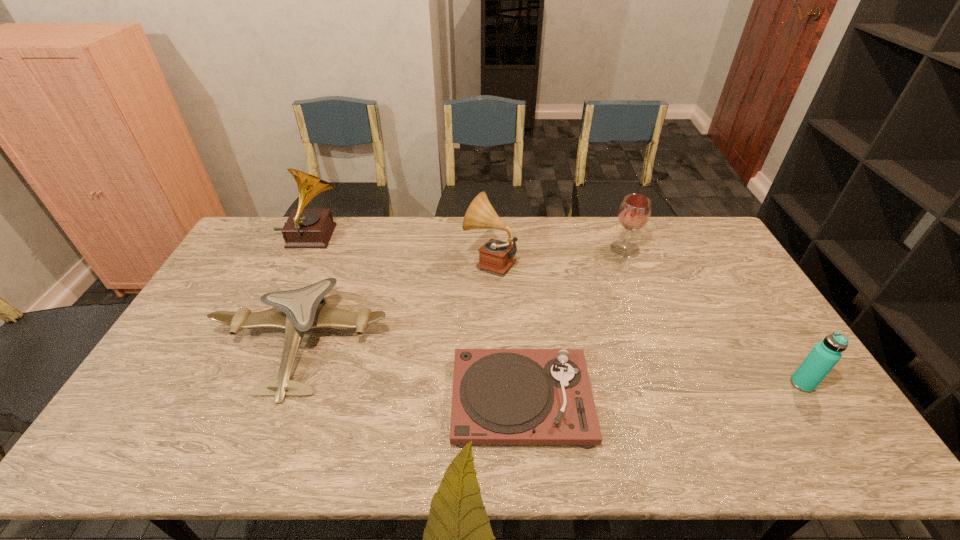
The image size is (960, 540). I want to click on empty space that is in between the water bottle and the second shortest phonograph_record, so click(x=646, y=322).

The height and width of the screenshot is (540, 960). I want to click on unoccupied area between the drone and the second tallest phonograph_record, so pyautogui.click(x=396, y=302).

Where is `vacant region between the wineglass and the shortest phonograph_record`? This screenshot has width=960, height=540. vacant region between the wineglass and the shortest phonograph_record is located at coordinates (573, 324).

You are a GUI agent. You are given a task and a screenshot of the screen. Output one action in this format:
    pyautogui.click(x=<x>, y=<y>)
    Task: Click on the vacant area that lies between the shortest object and the leftmost phonograph_record
    The width and height of the screenshot is (960, 540).
    Given the screenshot: What is the action you would take?
    pyautogui.click(x=416, y=318)

Where is `empty space between the second tallest phonograph_record and the fifth tallest object`? empty space between the second tallest phonograph_record and the fifth tallest object is located at coordinates (396, 302).

The image size is (960, 540). Find the location of `object that is the second closest to the fifth tallest object`. object that is the second closest to the fifth tallest object is located at coordinates (497, 256).

Identify the location of object that can be found as the third closest to the drone. (305, 228).

Where is `phonograph_record object that ranks as the closest to the wineglass`? This screenshot has width=960, height=540. phonograph_record object that ranks as the closest to the wineglass is located at coordinates click(497, 256).

Identify which phonograph_record is located as the nearest to the water bottle. Please provide its 2D coordinates. Your answer should be formatted as a tuple, i.e. [(x, y)], where the tuple contains the x and y coordinates of a point satisfying the conditions above.

[(500, 396)]

Find the location of `vacant space that satisfies the following two spatial constraints: 1. on the back side of the fifth object from left to right; 2. from the horn of the leftmost phonograph_record`. vacant space that satisfies the following two spatial constraints: 1. on the back side of the fifth object from left to right; 2. from the horn of the leftmost phonograph_record is located at coordinates (620, 237).